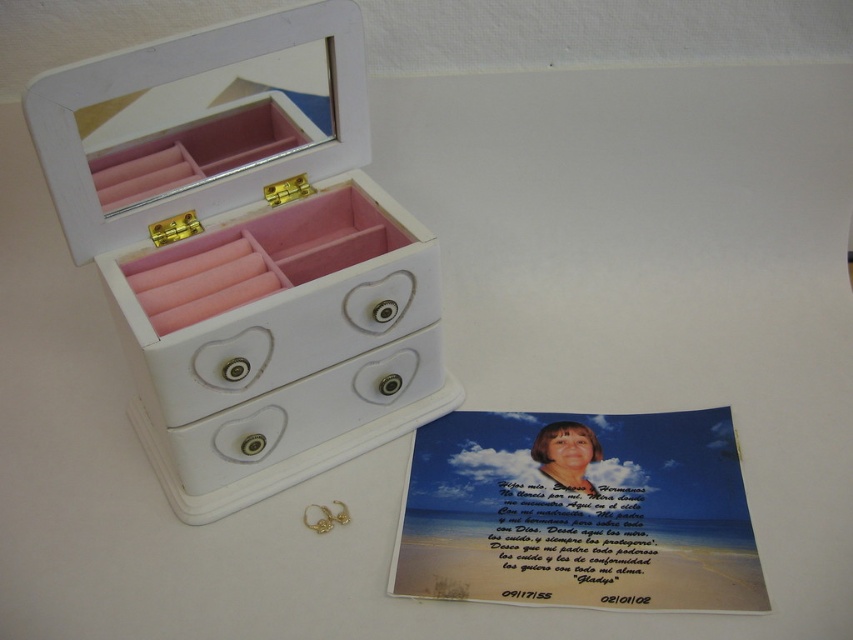
Does white matte jewelry box at center have a greater height compared to white matte drawer at center?

Yes, white matte jewelry box at center is taller than white matte drawer at center.

Can you confirm if white matte jewelry box at center is bigger than white matte drawer at center?

Yes.

Who is more forward, (274, 147) or (334, 435)?

Point (274, 147) is in front.

Find the location of a particular element. Image resolution: width=853 pixels, height=640 pixels. white matte jewelry box at center is located at coordinates (247, 253).